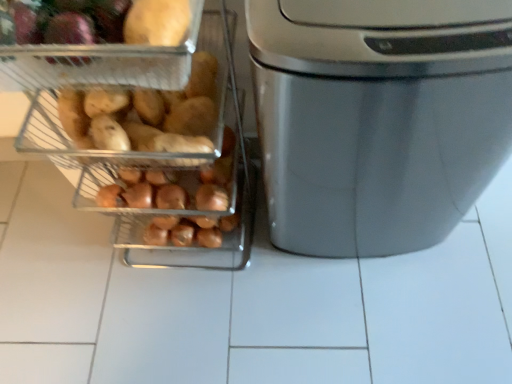
Question: Is metallic silver trash can at right beside matte yellow potato at upper left?

Choices:
 (A) no
 (B) yes

Answer: (A)

Question: Does metallic silver trash can at right have a greater width compared to matte yellow potato at upper left?

Choices:
 (A) yes
 (B) no

Answer: (A)

Question: From a real-world perspective, is metallic silver trash can at right beneath matte yellow potato at upper left?

Choices:
 (A) no
 (B) yes

Answer: (B)

Question: Is metallic silver trash can at right oriented away from matte yellow potato at upper left?

Choices:
 (A) no
 (B) yes

Answer: (A)

Question: Is there a large distance between metallic silver trash can at right and matte yellow potato at upper left?

Choices:
 (A) yes
 (B) no

Answer: (B)

Question: From the image's perspective, does metallic silver trash can at right appear lower than matte yellow potato at upper left?

Choices:
 (A) no
 (B) yes

Answer: (B)

Question: Is matte yellow potato at upper left smaller than satin silver trash can at right?

Choices:
 (A) yes
 (B) no

Answer: (A)

Question: Is matte yellow potato at upper left taller than satin silver trash can at right?

Choices:
 (A) no
 (B) yes

Answer: (A)

Question: Are matte yellow potato at upper left and satin silver trash can at right far apart?

Choices:
 (A) no
 (B) yes

Answer: (A)

Question: Is satin silver trash can at right inside matte yellow potato at upper left?

Choices:
 (A) no
 (B) yes

Answer: (A)

Question: Is matte yellow potato at upper left positioned with its back to satin silver trash can at right?

Choices:
 (A) yes
 (B) no

Answer: (B)

Question: From the image's perspective, is matte yellow potato at upper left under satin silver trash can at right?

Choices:
 (A) yes
 (B) no

Answer: (B)

Question: Is matte brown sweet potato at left to the right of metallic silver trash can at right from the viewer's perspective?

Choices:
 (A) yes
 (B) no

Answer: (B)